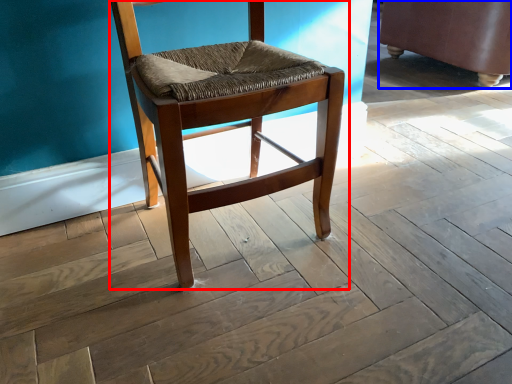
Question: Which point is further to the camera, chair (highlighted by a red box) or swivel chair (highlighted by a blue box)?

Choices:
 (A) chair
 (B) swivel chair

Answer: (B)